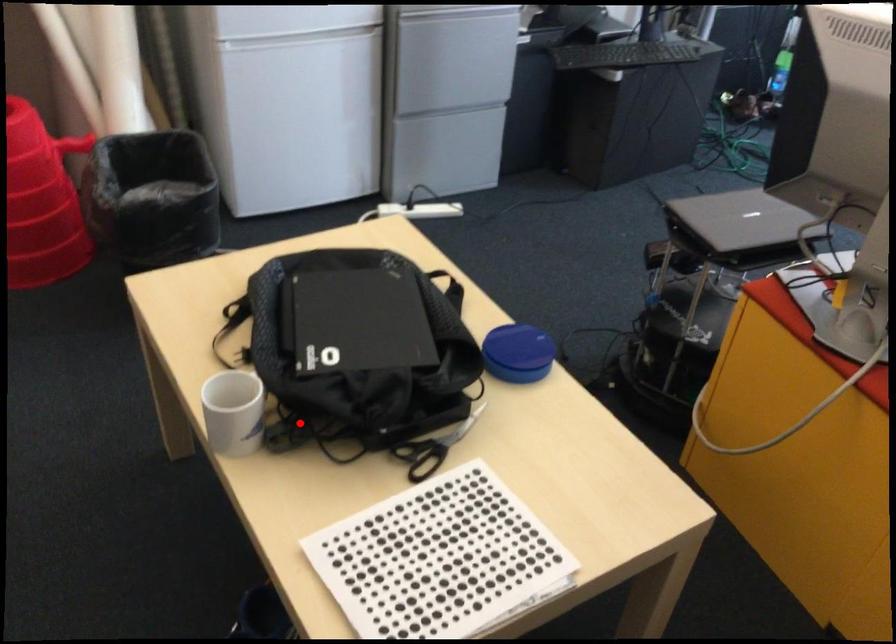
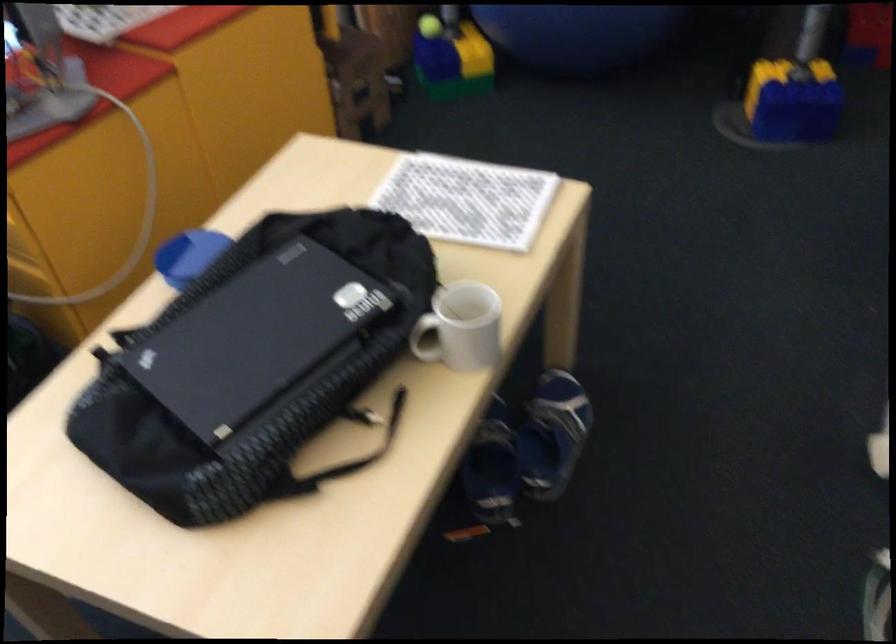
Question: I am providing you with two images of the same scene from different viewpoints. A red point is marked on the first image. Is the red point's position out of view in image 2?

Choices:
 (A) Yes
 (B) No

Answer: (B)